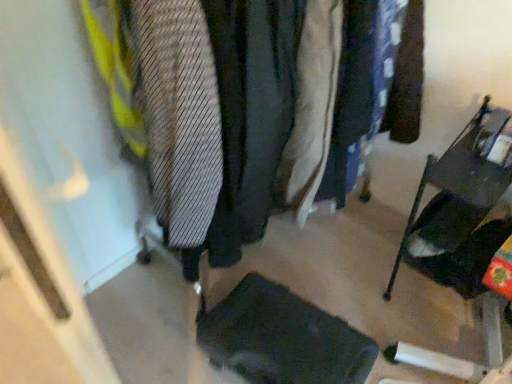
The height and width of the screenshot is (384, 512). I want to click on blank area beneath striped fabric tie at left (from a real-world perspective), so click(x=187, y=301).